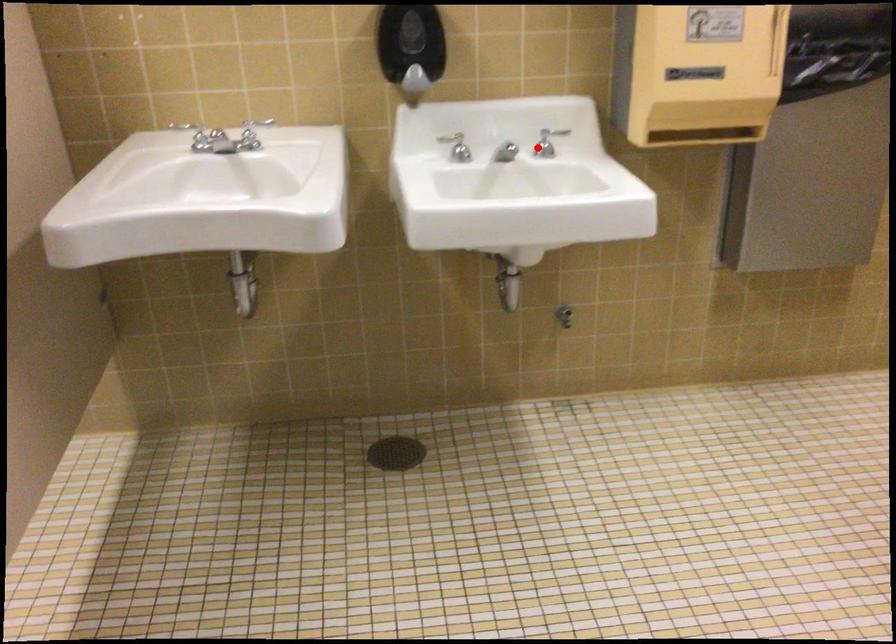
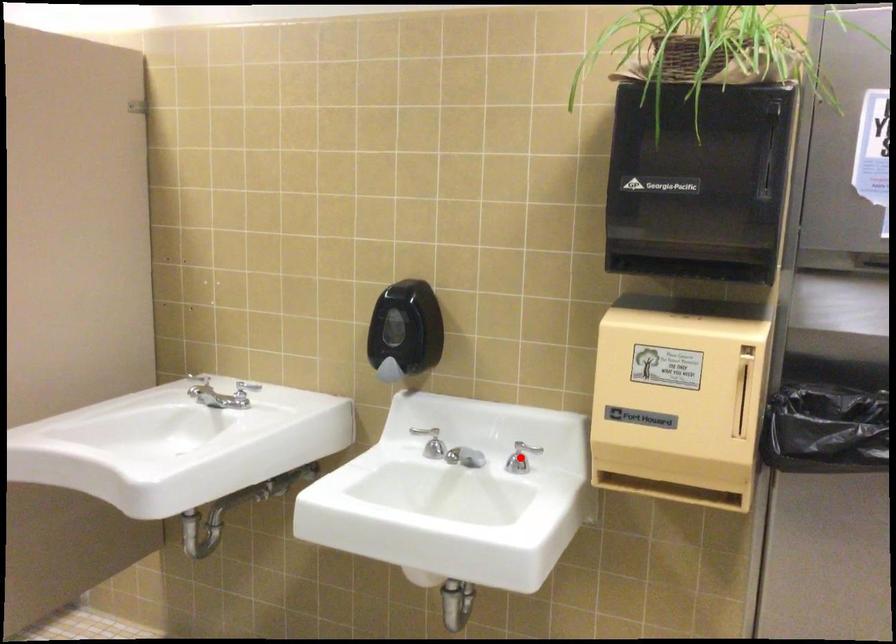
I am providing you with two images of the same scene from different viewpoints. A red point is marked on the first image and another point is marked on the second image. Is the marked point in image1 the same physical position as the marked point in image2?

Yes